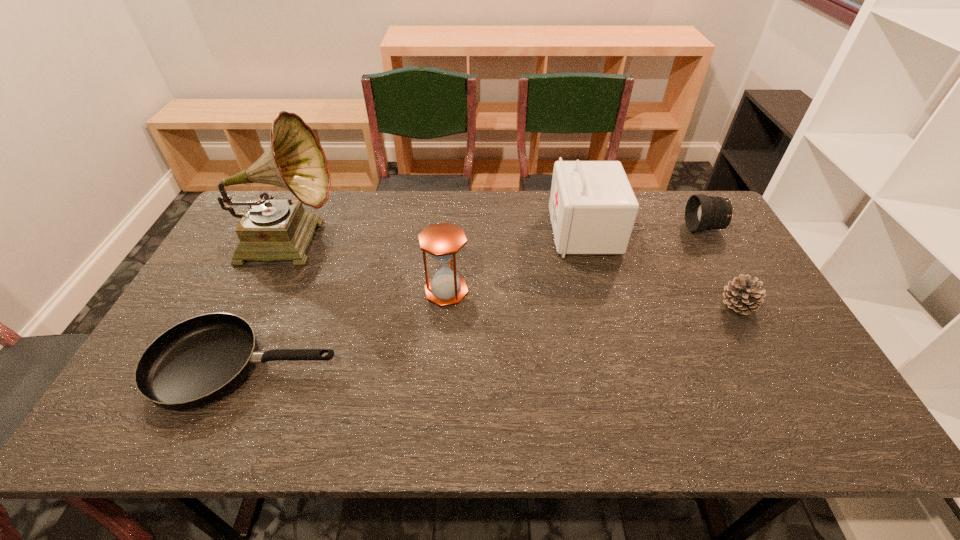
What are the coordinates of `record player` in the screenshot? It's located at (269, 230).

Identify the location of the fourth object from left to right. This screenshot has height=540, width=960. [592, 206].

Locate an element on the screen. Image resolution: width=960 pixels, height=540 pixels. the first-aid kit is located at coordinates (592, 206).

The height and width of the screenshot is (540, 960). I want to click on hourglass, so click(442, 241).

The width and height of the screenshot is (960, 540). What are the coordinates of `the fourth shortest object` in the screenshot? It's located at (442, 241).

Locate an element on the screen. Image resolution: width=960 pixels, height=540 pixels. telephoto lens is located at coordinates (702, 212).

Find the location of a particular element. The width and height of the screenshot is (960, 540). pinecone is located at coordinates (743, 295).

Where is `frying pan`? frying pan is located at coordinates (198, 361).

Find the location of a particular element. This screenshot has height=540, width=960. the nearest object is located at coordinates (198, 361).

This screenshot has width=960, height=540. Find the location of `free location located from the horn of the tallest object`. free location located from the horn of the tallest object is located at coordinates (365, 240).